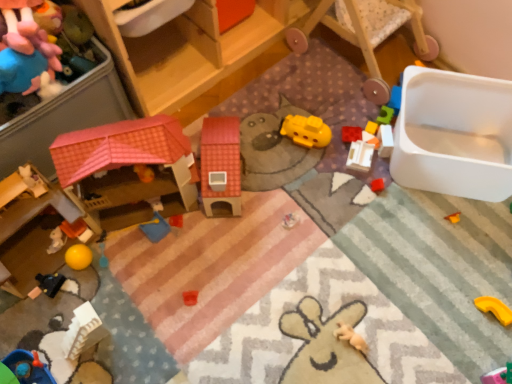
I want to click on free space between light brown plush toy at lower right, the sixth toy from the right, and black matte toy car at lower left, arranged as the 2th toy when viewed from the left, so click(x=203, y=313).